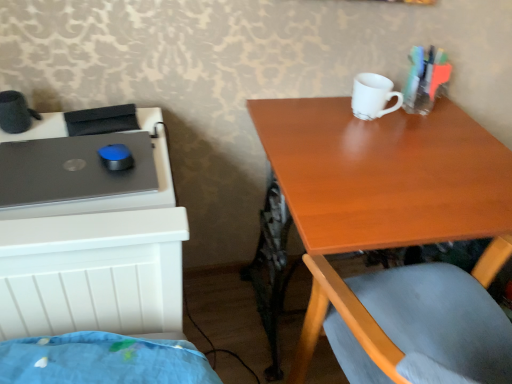
The width and height of the screenshot is (512, 384). I want to click on free space in front of translucent plastic markers at upper right, so click(x=426, y=139).